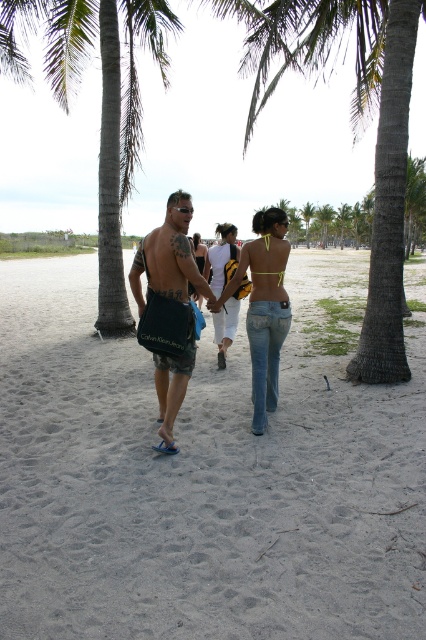
From the picture: You are a beachgoer who wants to store your belongings in either the gray textured trunk at right or the dark gray fabric bag at center. Based on their sizes, which one can hold more items?

The gray textured trunk at right has a larger size compared to the dark gray fabric bag at center, so it can hold more items.

You are standing at the beach scene described. There are two points marked in the image. Which point, point (284, 0) or point (198, 262), is closer to you?

Point (284, 0) is closer to the viewer than point (198, 262).